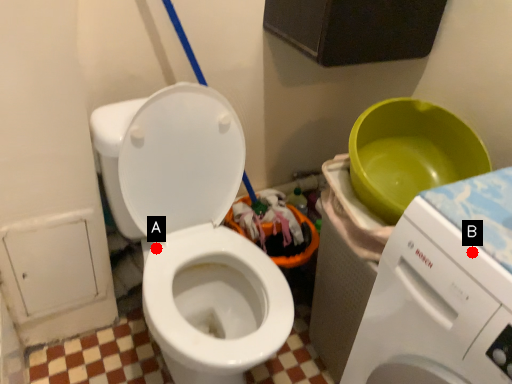
Question: Two points are circled on the image, labeled by A and B beside each circle. Which point is closer to the camera taking this photo?

Choices:
 (A) A is closer
 (B) B is closer

Answer: (B)